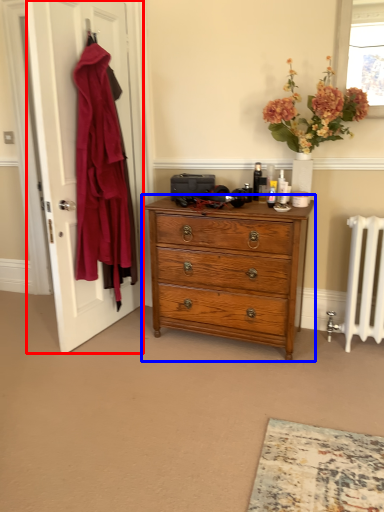
Question: Which object appears farthest to the camera in this image, door (highlighted by a red box) or chest of drawers (highlighted by a blue box)?

Choices:
 (A) door
 (B) chest of drawers

Answer: (B)